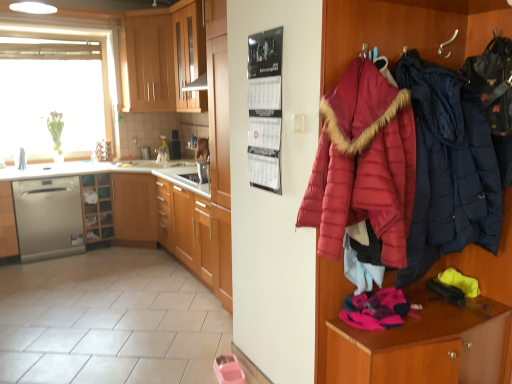
Question: Which direction should I rotate to look at wooden cabinet at upper center, the second cabinetry when ordered from left to right, — up or down?

Choices:
 (A) up
 (B) down

Answer: (A)

Question: Considering the relative sizes of white glossy sink at center and wooden cabinet at upper center, placed as the 3th cabinetry when sorted from right to left, in the image provided, is white glossy sink at center bigger than wooden cabinet at upper center, placed as the 3th cabinetry when sorted from right to left,?

Choices:
 (A) yes
 (B) no

Answer: (B)

Question: From the image's perspective, is white glossy sink at center located beneath wooden cabinet at upper center, placed as the 3th cabinetry when sorted from right to left?

Choices:
 (A) no
 (B) yes

Answer: (B)

Question: Is white glossy sink at center facing towards wooden cabinet at upper center, the second cabinetry when ordered from left to right?

Choices:
 (A) yes
 (B) no

Answer: (B)

Question: From the image's perspective, is white glossy sink at center above wooden cabinet at upper center, the second cabinetry when ordered from left to right?

Choices:
 (A) no
 (B) yes

Answer: (A)

Question: Is white glossy sink at center completely or partially outside of wooden cabinet at upper center, the second cabinetry when ordered from left to right?

Choices:
 (A) yes
 (B) no

Answer: (A)

Question: Does white glossy sink at center come in front of wooden cabinet at upper center, the second cabinetry when ordered from left to right?

Choices:
 (A) no
 (B) yes

Answer: (A)

Question: Is satin silver dishwasher at left, arranged as the 4th cabinetry when viewed from the right, wider than wooden cabinets at center, arranged as the 4th cabinetry when viewed from the left?

Choices:
 (A) yes
 (B) no

Answer: (B)

Question: Is satin silver dishwasher at left, arranged as the 4th cabinetry when viewed from the right, to the left of wooden cabinets at center, arranged as the 4th cabinetry when viewed from the left, from the viewer's perspective?

Choices:
 (A) no
 (B) yes

Answer: (B)

Question: Is satin silver dishwasher at left, arranged as the 4th cabinetry when viewed from the right, oriented away from wooden cabinets at center, marked as the first cabinetry in a right-to-left arrangement?

Choices:
 (A) no
 (B) yes

Answer: (A)

Question: Is satin silver dishwasher at left, arranged as the 4th cabinetry when viewed from the right, further to the viewer compared to wooden cabinets at center, marked as the first cabinetry in a right-to-left arrangement?

Choices:
 (A) no
 (B) yes

Answer: (B)

Question: Is satin silver dishwasher at left, acting as the 1th cabinetry starting from the left, shorter than wooden cabinets at center, marked as the first cabinetry in a right-to-left arrangement?

Choices:
 (A) no
 (B) yes

Answer: (B)

Question: Is wooden cabinets at center, arranged as the 4th cabinetry when viewed from the left, a part of satin silver dishwasher at left, arranged as the 4th cabinetry when viewed from the right?

Choices:
 (A) no
 (B) yes

Answer: (A)

Question: From the image's perspective, is dark blue quilted jacket at right, which is the second jacket in left-to-right order, on top of satin silver dishwasher at lower left?

Choices:
 (A) yes
 (B) no

Answer: (A)